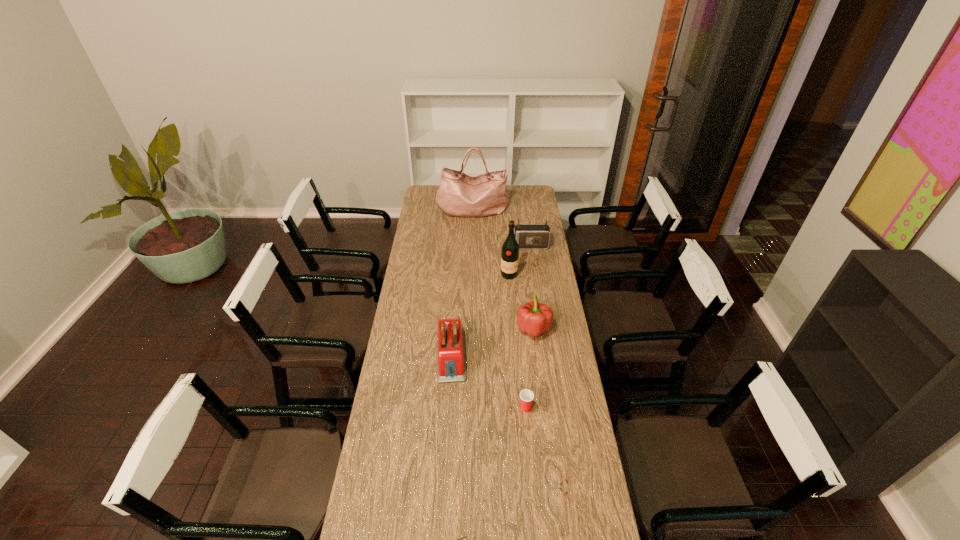
Identify the location of the farthest object. (460, 195).

This screenshot has height=540, width=960. Identify the location of handbag. (460, 195).

Where is `liquor`? The height and width of the screenshot is (540, 960). liquor is located at coordinates (510, 250).

What are the coordinates of `the second tallest object` in the screenshot? It's located at (510, 250).

Locate an element on the screen. Image resolution: width=960 pixels, height=540 pixels. toaster is located at coordinates (451, 364).

At what (x,y) coordinates should I click in order to perform the action: click on the seventh nearest object. Please return your answer as a coordinate pair (x, y). The height and width of the screenshot is (540, 960). Looking at the image, I should click on (528, 236).

The width and height of the screenshot is (960, 540). In order to click on bell pepper in this screenshot , I will do `click(534, 318)`.

The height and width of the screenshot is (540, 960). What are the coordinates of `the third nearest object` in the screenshot? It's located at (526, 396).

Find the location of a particular element. This screenshot has height=540, width=960. Dixie cup is located at coordinates (526, 396).

Where is `the seventh farthest object`? the seventh farthest object is located at coordinates coord(557,486).